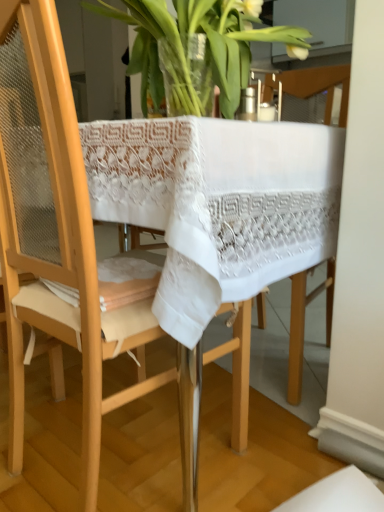
Question: From a real-world perspective, is wooden chair at center over translucent glass vase at upper center?

Choices:
 (A) yes
 (B) no

Answer: (B)

Question: From a real-world perspective, is wooden chair at center below translucent glass vase at upper center?

Choices:
 (A) no
 (B) yes

Answer: (B)

Question: Is wooden chair at center at the right side of translucent glass vase at upper center?

Choices:
 (A) yes
 (B) no

Answer: (B)

Question: Does wooden chair at center have a greater width compared to translucent glass vase at upper center?

Choices:
 (A) no
 (B) yes

Answer: (B)

Question: Is translucent glass vase at upper center completely or partially inside wooden chair at center?

Choices:
 (A) yes
 (B) no

Answer: (B)

Question: Is wooden chair at center not near translucent glass vase at upper center?

Choices:
 (A) yes
 (B) no

Answer: (B)

Question: Does translucent glass vase at upper center come behind wooden chair at center?

Choices:
 (A) yes
 (B) no

Answer: (A)

Question: From a real-world perspective, is translucent glass vase at upper center on top of wooden chair at center?

Choices:
 (A) no
 (B) yes

Answer: (B)

Question: From the image's perspective, is translucent glass vase at upper center located beneath wooden chair at center?

Choices:
 (A) no
 (B) yes

Answer: (A)

Question: Are translucent glass vase at upper center and wooden chair at center located far from each other?

Choices:
 (A) yes
 (B) no

Answer: (B)

Question: Can you confirm if translucent glass vase at upper center is shorter than wooden chair at center?

Choices:
 (A) yes
 (B) no

Answer: (A)

Question: Does translucent glass vase at upper center have a greater height compared to wooden chair at center?

Choices:
 (A) yes
 (B) no

Answer: (B)

Question: Considering the positions of wooden chair at center and translucent glass vase at upper center in the image, is wooden chair at center taller or shorter than translucent glass vase at upper center?

Choices:
 (A) short
 (B) tall

Answer: (B)